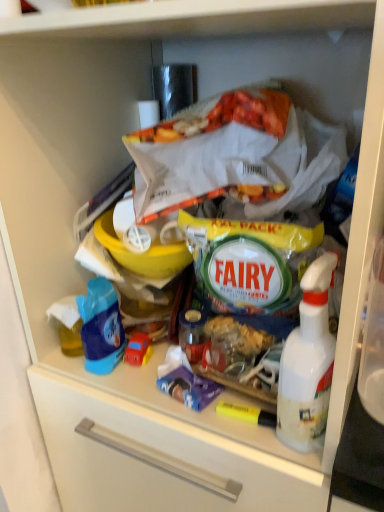
Question: Is the position of white plastic spray bottle at right less distant than that of blue plastic toy car at left?

Choices:
 (A) no
 (B) yes

Answer: (B)

Question: Can you confirm if white plastic spray bottle at right is taller than blue plastic toy car at left?

Choices:
 (A) yes
 (B) no

Answer: (A)

Question: Could you tell me if white plastic spray bottle at right is turned towards blue plastic toy car at left?

Choices:
 (A) no
 (B) yes

Answer: (A)

Question: Is white plastic spray bottle at right with blue plastic toy car at left?

Choices:
 (A) yes
 (B) no

Answer: (B)

Question: From the image's perspective, is white plastic spray bottle at right above blue plastic toy car at left?

Choices:
 (A) no
 (B) yes

Answer: (A)

Question: Is white plastic spray bottle at right further to camera compared to blue plastic toy car at left?

Choices:
 (A) no
 (B) yes

Answer: (A)

Question: Are blue plastic toy car at left and rubber car at center beside each other?

Choices:
 (A) yes
 (B) no

Answer: (A)

Question: Is rubber car at center located within blue plastic toy car at left?

Choices:
 (A) yes
 (B) no

Answer: (B)

Question: Is blue plastic toy car at left completely or partially outside of rubber car at center?

Choices:
 (A) no
 (B) yes

Answer: (B)

Question: Is blue plastic toy car at left to the left of rubber car at center from the viewer's perspective?

Choices:
 (A) yes
 (B) no

Answer: (A)

Question: Considering the relative positions of blue plastic toy car at left and rubber car at center in the image provided, is blue plastic toy car at left in front of rubber car at center?

Choices:
 (A) no
 (B) yes

Answer: (B)

Question: Can you confirm if blue plastic toy car at left is bigger than rubber car at center?

Choices:
 (A) yes
 (B) no

Answer: (A)

Question: Could you tell me if rubber car at center is facing blue plastic toy car at left?

Choices:
 (A) no
 (B) yes

Answer: (A)